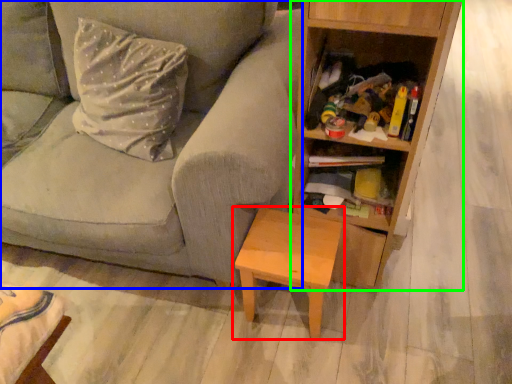
Question: Which object is positioned closest to table (highlighted by a red box)? Select from studio couch (highlighted by a blue box) and bookcase (highlighted by a green box).

Choices:
 (A) studio couch
 (B) bookcase

Answer: (B)